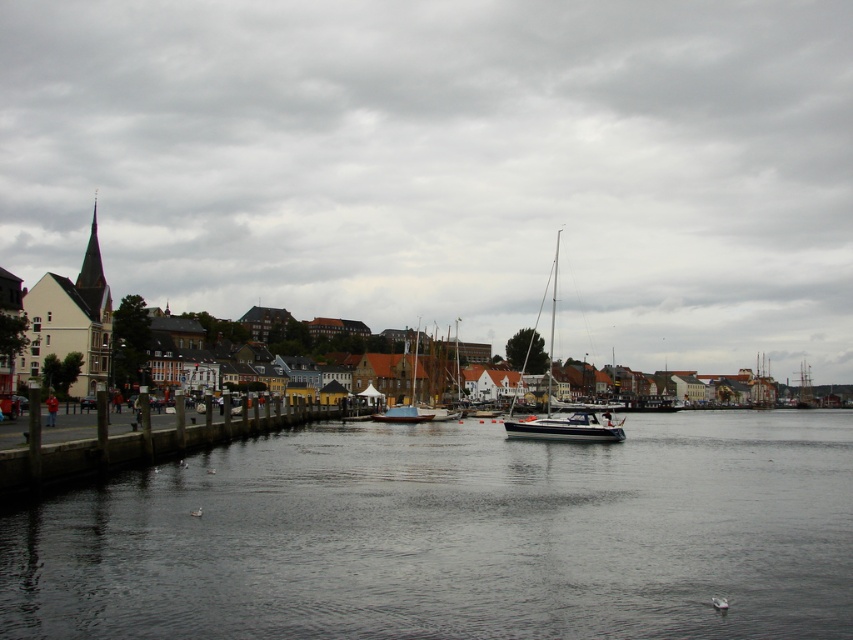
Does transparent water at center come in front of concrete dock at left?

Yes, it is in front of concrete dock at left.

Is transparent water at center above concrete dock at left?

Actually, transparent water at center is below concrete dock at left.

Does point (405, 604) come behind point (44, 476)?

No.

Where is `transparent water at center`? transparent water at center is located at coordinates (454, 536).

From the picture: Is cloudy sky at upper center wider than concrete dock at left?

Yes.

Is point (32, 195) less distant than point (77, 461)?

No, (32, 195) is further to viewer.

Between point (849, 116) and point (42, 481), which one is positioned behind?

Point (849, 116)

Where is `cloudy sky at upper center`? cloudy sky at upper center is located at coordinates point(450,166).

Is white glossy boat at center to the left of white wooden sailboat at center from the viewer's perspective?

No, white glossy boat at center is not to the left of white wooden sailboat at center.

Between point (553, 436) and point (416, 360), which one is positioned in front?

Point (553, 436) is in front.

Between point (575, 440) and point (389, 410), which one is positioned in front?

Point (575, 440)

I want to click on white glossy boat at center, so click(567, 428).